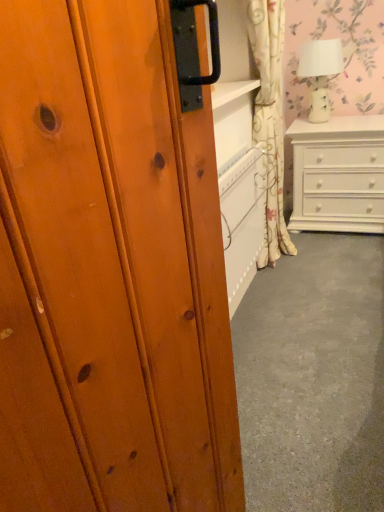
Question: From the image's perspective, would you say white glossy chest of drawers at right is positioned over floral fabric curtain at upper right?

Choices:
 (A) no
 (B) yes

Answer: (A)

Question: Can you see white glossy chest of drawers at right touching floral fabric curtain at upper right?

Choices:
 (A) no
 (B) yes

Answer: (A)

Question: Is white glossy chest of drawers at right positioned beyond the bounds of floral fabric curtain at upper right?

Choices:
 (A) yes
 (B) no

Answer: (A)

Question: Can you confirm if white glossy chest of drawers at right is shorter than floral fabric curtain at upper right?

Choices:
 (A) no
 (B) yes

Answer: (B)

Question: Considering the relative sizes of white glossy chest of drawers at right and floral fabric curtain at upper right in the image provided, is white glossy chest of drawers at right taller than floral fabric curtain at upper right?

Choices:
 (A) yes
 (B) no

Answer: (B)

Question: From a real-world perspective, is white glossy chest of drawers at right physically located above or below white ceramic lamp at upper right?

Choices:
 (A) below
 (B) above

Answer: (A)

Question: Is point (347, 202) closer or farther from the camera than point (339, 72)?

Choices:
 (A) farther
 (B) closer

Answer: (A)

Question: Choose the correct answer: Is white glossy chest of drawers at right inside white ceramic lamp at upper right or outside it?

Choices:
 (A) inside
 (B) outside

Answer: (B)

Question: Relative to white ceramic lamp at upper right, is white glossy chest of drawers at right in front or behind?

Choices:
 (A) behind
 (B) front

Answer: (B)

Question: From a real-world perspective, is white glossy chest of drawers at right positioned above or below floral fabric curtain at upper right?

Choices:
 (A) above
 (B) below

Answer: (B)

Question: Is white glossy chest of drawers at right wider or thinner than floral fabric curtain at upper right?

Choices:
 (A) wide
 (B) thin

Answer: (A)

Question: Based on their sizes in the image, would you say white glossy chest of drawers at right is bigger or smaller than floral fabric curtain at upper right?

Choices:
 (A) big
 (B) small

Answer: (A)

Question: Visually, is white glossy chest of drawers at right positioned to the left or to the right of floral fabric curtain at upper right?

Choices:
 (A) left
 (B) right

Answer: (B)

Question: Based on their positions, is floral fabric curtain at upper right located to the left or right of white ceramic lamp at upper right?

Choices:
 (A) right
 (B) left

Answer: (B)

Question: From a real-world perspective, is floral fabric curtain at upper right above or below white ceramic lamp at upper right?

Choices:
 (A) below
 (B) above

Answer: (A)